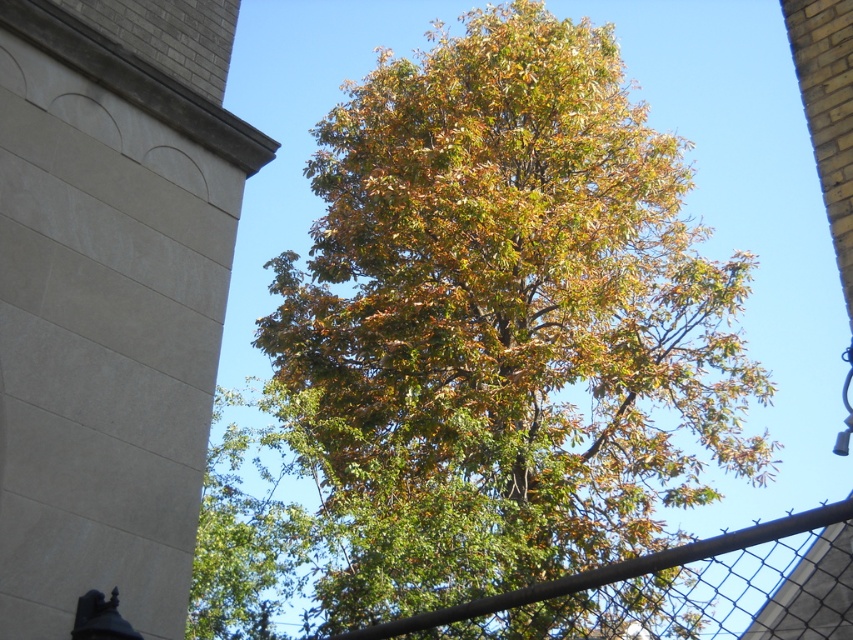
You are standing in the park and notice the green leafy tree at center and the beige stone tower at upper left. Which object takes up more space in the image?

The green leafy tree at center takes up more space in the image because it is larger in size than the beige stone tower at upper left.

You are standing in a park and see the beige stone tower at upper left and the rustic metal fence at center. Which object is higher in the image?

The beige stone tower at upper left is positioned over the rustic metal fence at center, so it is higher in the image.